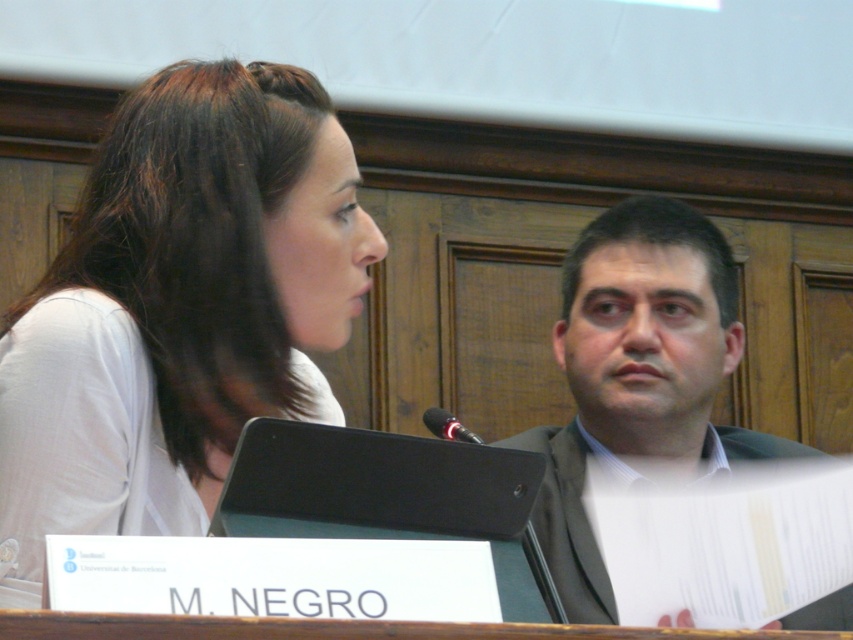
Question: Does white matte shirt at upper left have a greater width compared to dark gray suit at right?

Choices:
 (A) no
 (B) yes

Answer: (A)

Question: Does white matte shirt at upper left appear on the left side of dark gray suit at right?

Choices:
 (A) yes
 (B) no

Answer: (A)

Question: Where is white matte shirt at upper left located in relation to dark gray suit at right in the image?

Choices:
 (A) below
 (B) above

Answer: (B)

Question: Which point is closer to the camera?

Choices:
 (A) (614, 449)
 (B) (36, 588)

Answer: (B)

Question: Which of the following is the closest to the observer?

Choices:
 (A) (566, 568)
 (B) (245, 364)

Answer: (B)